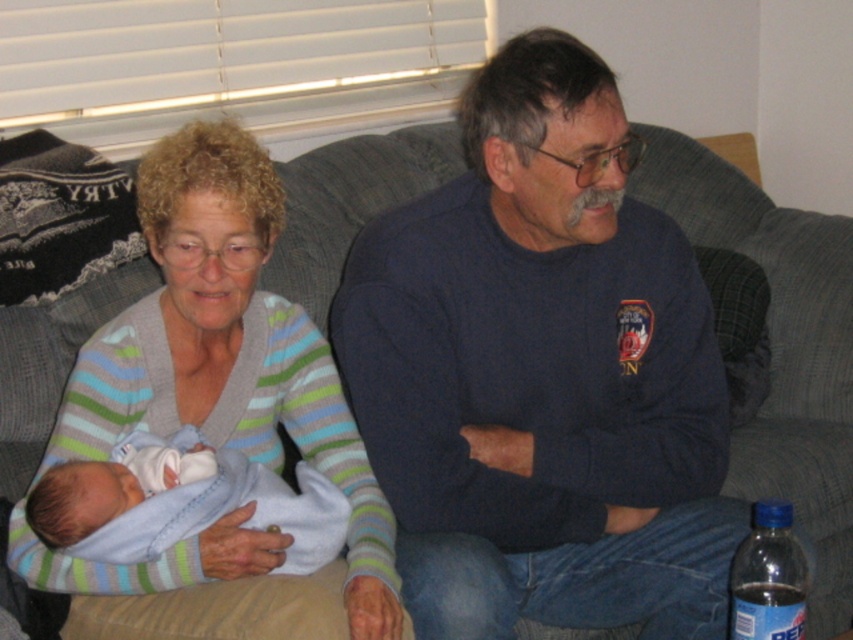
Does dark blue sweater at center appear under light blue soft fabric newborn at center?

Actually, dark blue sweater at center is above light blue soft fabric newborn at center.

Is dark blue sweater at center positioned behind light blue soft fabric newborn at center?

Yes, it is behind light blue soft fabric newborn at center.

Locate an element on the screen. dark blue sweater at center is located at coordinates (541, 372).

Is point (221, 243) closer to camera compared to point (744, 620)?

No.

Can you confirm if striped sweater at center is positioned to the right of clear plastic bottle at lower right?

Incorrect, striped sweater at center is not on the right side of clear plastic bottle at lower right.

Which is behind, point (144, 598) or point (795, 602)?

The point (144, 598) is behind.

I want to click on striped sweater at center, so click(x=228, y=352).

Does dark blue sweater at center appear under striped sweater at center?

Actually, dark blue sweater at center is above striped sweater at center.

Between point (505, 168) and point (136, 372), which one is positioned behind?

Positioned behind is point (136, 372).

Is point (691, 550) farther from camera compared to point (329, 436)?

No, it is not.

What are the coordinates of `dark blue sweater at center` in the screenshot? It's located at (541, 372).